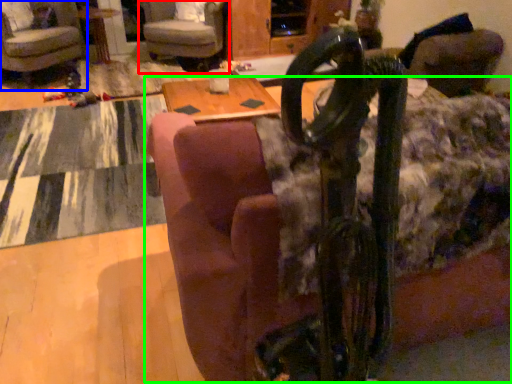
Question: Estimate the real-world distances between objects in this image. Which object is farther from chair (highlighted by a red box), chair (highlighted by a blue box) or couch (highlighted by a green box)?

Choices:
 (A) chair
 (B) couch

Answer: (B)